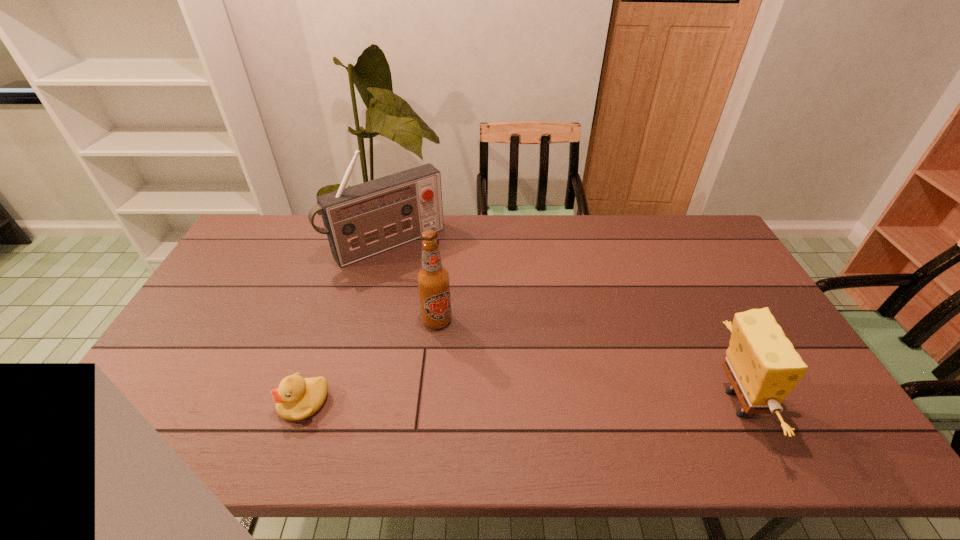
Locate an element on the screen. This screenshot has height=540, width=960. duckling is located at coordinates (297, 398).

Where is `the rightmost object`? the rightmost object is located at coordinates (761, 363).

Where is `sponge`? sponge is located at coordinates (761, 363).

Find the location of `the farthest object`. the farthest object is located at coordinates (360, 221).

In order to click on the third nearest object in this screenshot , I will do `click(433, 280)`.

I want to click on the second tallest object, so click(433, 280).

Image resolution: width=960 pixels, height=540 pixels. In order to click on vacant space situated on the beak of the duckling in this screenshot , I will do `click(163, 403)`.

Where is `vacant space located 0.080m on the beak of the duckling`? This screenshot has height=540, width=960. vacant space located 0.080m on the beak of the duckling is located at coordinates (248, 403).

At what (x,y) coordinates should I click in order to perform the action: click on free space located 0.170m on the beak of the duckling. Please return your answer as a coordinate pair (x, y). Looking at the image, I should click on (211, 403).

This screenshot has height=540, width=960. In order to click on vacant area situated on the face of the third tallest object in this screenshot , I will do `click(827, 403)`.